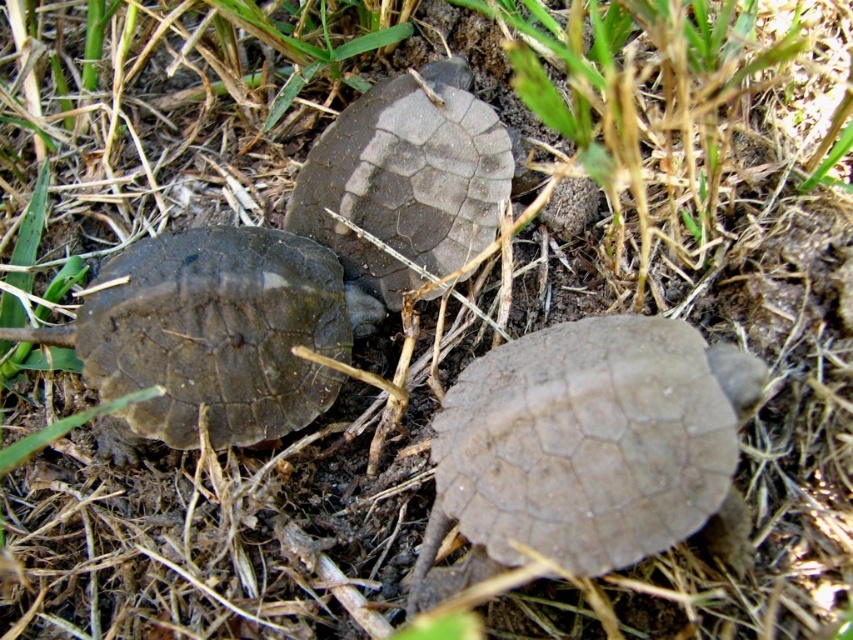
Does brown matte tortoise at lower right appear over matte brown tortoise shell at center?

Actually, brown matte tortoise at lower right is below matte brown tortoise shell at center.

The image size is (853, 640). Describe the element at coordinates (583, 449) in the screenshot. I see `brown matte tortoise at lower right` at that location.

What are the coordinates of `brown matte tortoise at lower right` in the screenshot? It's located at (583, 449).

Between matte brown tortoise shell at center and matte brown tortoise at left, which one is positioned higher?

matte brown tortoise shell at center is higher up.

Does matte brown tortoise shell at center appear over matte brown tortoise at left?

Indeed, matte brown tortoise shell at center is positioned over matte brown tortoise at left.

In order to click on matte brown tortoise shell at center in this screenshot , I will do `click(402, 186)`.

Does brown matte tortoise at lower right come behind matte brown tortoise at left?

No, brown matte tortoise at lower right is closer to the viewer.

Does brown matte tortoise at lower right appear on the right side of matte brown tortoise at left?

Yes, brown matte tortoise at lower right is to the right of matte brown tortoise at left.

Does point (643, 384) come behind point (329, 314)?

That is False.

At what (x,y) coordinates should I click in order to perform the action: click on brown matte tortoise at lower right. Please return your answer as a coordinate pair (x, y). Looking at the image, I should click on (583, 449).